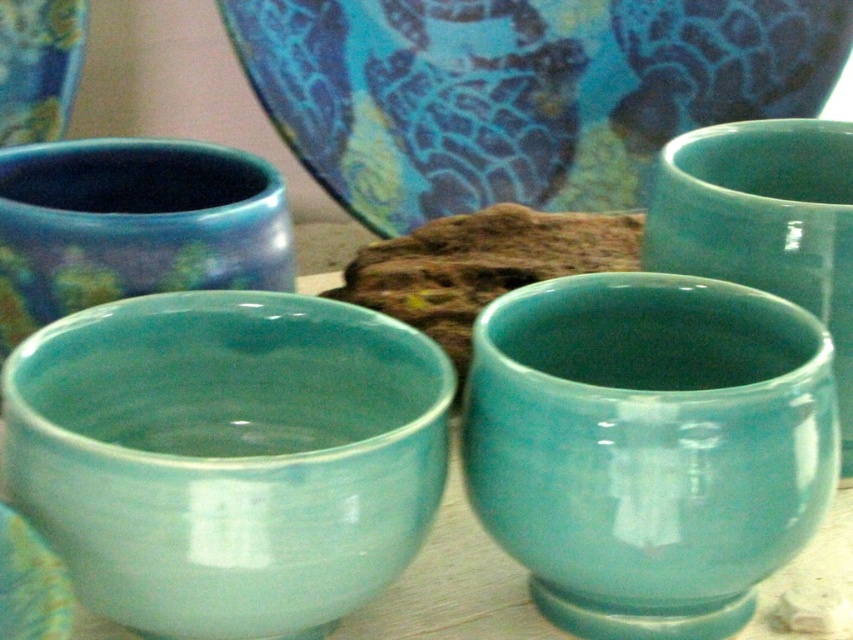
Question: Does matte ceramic bowl at center have a greater width compared to matte ceramic cup at center?

Choices:
 (A) no
 (B) yes

Answer: (B)

Question: Which point is closer to the camera taking this photo?

Choices:
 (A) (813, 369)
 (B) (167, 618)

Answer: (B)

Question: Which object is farther from the camera taking this photo?

Choices:
 (A) matte ceramic cup at center
 (B) matte ceramic bowl at center

Answer: (A)

Question: Is matte ceramic bowl at center closer to camera compared to matte ceramic cup at center?

Choices:
 (A) yes
 (B) no

Answer: (A)

Question: Is matte ceramic bowl at center wider than matte ceramic cup at center?

Choices:
 (A) no
 (B) yes

Answer: (B)